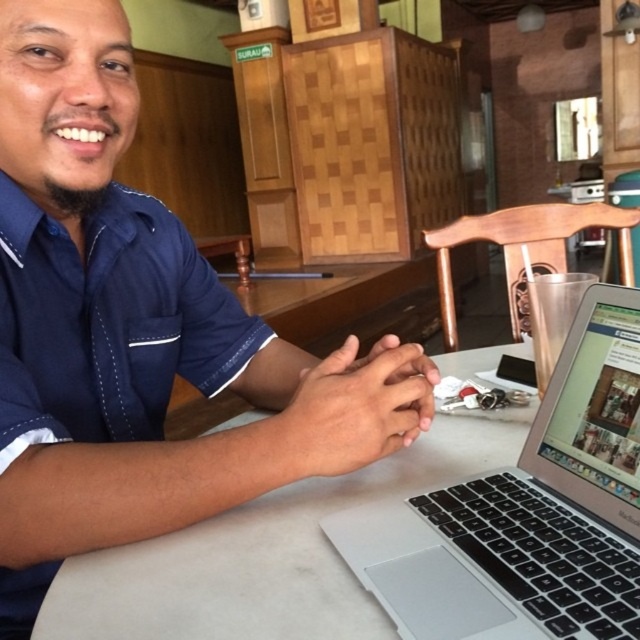
You are a photographer trying to capture a closeup of the silver metallic laptop at center without the blue fabric shirt at center appearing in the frame. Is this possible given their sizes?

The blue fabric shirt at center is bigger than the silver metallic laptop at center, so it might block the view of the laptop. Adjust your angle or move closer to avoid the shirt.

You are a photographer taking a portrait of the man in the scene. The blue fabric shirt at center and the silver metallic laptop at center are both in the frame. If you want to ensure both objects are fully visible without cropping, which object requires more horizontal space in the frame?

The blue fabric shirt at center requires more horizontal space in the frame because its width surpasses that of the silver metallic laptop at center.

You are a photographer trying to capture a wide shot of the blue fabric shirt at center and the white matte table at center. Given that your camera can only capture objects within a 1.5 meter width, will both objects fit in the frame?

The blue fabric shirt at center is narrower than the white matte table at center. Since the camera can capture up to 1.5 meters, and the table is wider, but the shirt is narrower, both objects can fit within the frame as long as their combined width doesn